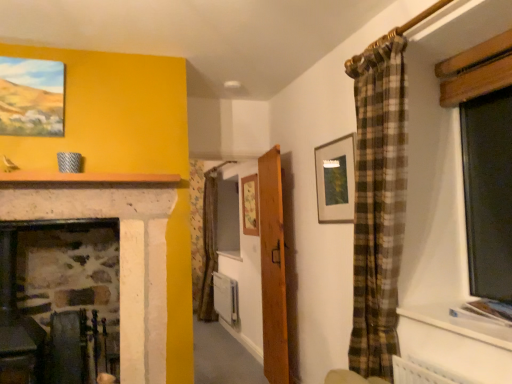
Question: Is matte wooden picture frame at upper left, the third picture frame when ordered from back to front, completely or partially outside of wooden door at center?

Choices:
 (A) yes
 (B) no

Answer: (A)

Question: Does matte wooden picture frame at upper left, which is the third picture frame in right-to-left order, have a lesser width compared to wooden door at center?

Choices:
 (A) no
 (B) yes

Answer: (B)

Question: Considering the relative positions of matte wooden picture frame at upper left, which is the third picture frame in right-to-left order, and wooden door at center in the image provided, is matte wooden picture frame at upper left, which is the third picture frame in right-to-left order, behind wooden door at center?

Choices:
 (A) yes
 (B) no

Answer: (B)

Question: Is matte wooden picture frame at upper left, which is the third picture frame in right-to-left order, positioned in front of wooden door at center?

Choices:
 (A) no
 (B) yes

Answer: (B)

Question: Does matte wooden picture frame at upper left, which is the third picture frame in right-to-left order, have a larger size compared to wooden door at center?

Choices:
 (A) no
 (B) yes

Answer: (A)

Question: From their relative heights in the image, would you say white stone mantle at upper center is taller or shorter than white plastic radiator at center?

Choices:
 (A) short
 (B) tall

Answer: (A)

Question: From the image's perspective, relative to white plastic radiator at center, is white stone mantle at upper center above or below?

Choices:
 (A) above
 (B) below

Answer: (A)

Question: Based on their sizes in the image, would you say white stone mantle at upper center is bigger or smaller than white plastic radiator at center?

Choices:
 (A) small
 (B) big

Answer: (A)

Question: Is white stone mantle at upper center to the left or to the right of white plastic radiator at center in the image?

Choices:
 (A) left
 (B) right

Answer: (A)

Question: Is point (53, 77) closer or farther from the camera than point (234, 291)?

Choices:
 (A) farther
 (B) closer

Answer: (B)

Question: Is matte wooden picture frame at upper left, the third picture frame when ordered from back to front, in front of or behind white plastic radiator at center in the image?

Choices:
 (A) front
 (B) behind

Answer: (A)

Question: From the image's perspective, is matte wooden picture frame at upper left, which is the third picture frame in right-to-left order, positioned above or below white plastic radiator at center?

Choices:
 (A) below
 (B) above

Answer: (B)

Question: Which is correct: matte wooden picture frame at upper left, marked as the 1th picture frame in a left-to-right arrangement, is inside white plastic radiator at center, or outside of it?

Choices:
 (A) inside
 (B) outside

Answer: (B)

Question: Visually, is matte gold picture frame at upper center, which ranks as the second picture frame in back-to-front order, positioned to the left or to the right of wooden door at center?

Choices:
 (A) left
 (B) right

Answer: (B)

Question: From the image's perspective, is matte gold picture frame at upper center, which ranks as the second picture frame in back-to-front order, positioned above or below wooden door at center?

Choices:
 (A) above
 (B) below

Answer: (A)